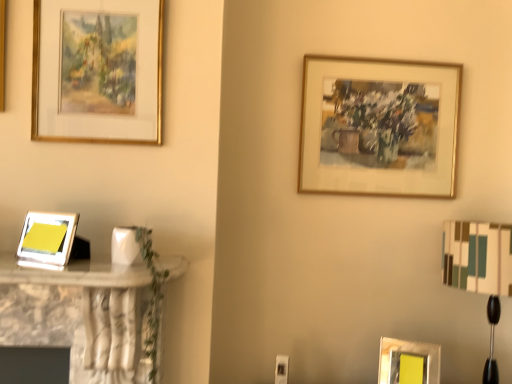
Question: From a real-world perspective, does matte silver picture frame at left, which appears as the fourth picture frame when viewed from the back, sit lower than gold-framed painting at upper left, the second picture frame viewed from the left?

Choices:
 (A) no
 (B) yes

Answer: (B)

Question: Can you confirm if matte silver picture frame at left, acting as the third picture frame starting from the top, is taller than gold-framed painting at upper left, the 1th picture frame from the top?

Choices:
 (A) yes
 (B) no

Answer: (B)

Question: Considering the relative positions of matte silver picture frame at left, acting as the third picture frame starting from the top, and gold-framed painting at upper left, the fourth picture frame in the bottom-to-top sequence, in the image provided, is matte silver picture frame at left, acting as the third picture frame starting from the top, behind gold-framed painting at upper left, the fourth picture frame in the bottom-to-top sequence,?

Choices:
 (A) yes
 (B) no

Answer: (B)

Question: From the image's perspective, is matte silver picture frame at left, which appears as the fourth picture frame when viewed from the back, below gold-framed painting at upper left, the 1th picture frame from the top?

Choices:
 (A) yes
 (B) no

Answer: (A)

Question: Can you confirm if matte silver picture frame at left, which appears as the fourth picture frame when viewed from the back, is wider than gold-framed painting at upper left, the 1th picture frame from the top?

Choices:
 (A) yes
 (B) no

Answer: (A)

Question: Is gold-framed painting at upper left, marked as the third picture frame in a back-to-front arrangement, at the back of matte silver picture frame at left, acting as the third picture frame starting from the top?

Choices:
 (A) yes
 (B) no

Answer: (B)

Question: Can you confirm if white fabric lampshade at right is smaller than gold-framed painting at upper left, the 1th picture frame from the top?

Choices:
 (A) no
 (B) yes

Answer: (A)

Question: From the image's perspective, is white fabric lampshade at right over gold-framed painting at upper left, the second picture frame viewed from the left?

Choices:
 (A) yes
 (B) no

Answer: (B)

Question: Does white fabric lampshade at right have a greater height compared to gold-framed painting at upper left, the fourth picture frame in the bottom-to-top sequence?

Choices:
 (A) yes
 (B) no

Answer: (A)

Question: Would you consider white fabric lampshade at right to be distant from gold-framed painting at upper left, marked as the third picture frame in a back-to-front arrangement?

Choices:
 (A) no
 (B) yes

Answer: (B)

Question: From a real-world perspective, is white fabric lampshade at right on gold-framed painting at upper left, the second picture frame viewed from the left?

Choices:
 (A) no
 (B) yes

Answer: (A)

Question: From the image's perspective, does white fabric lampshade at right appear lower than gold-framed painting at upper left, the fourth picture frame in the bottom-to-top sequence?

Choices:
 (A) no
 (B) yes

Answer: (B)

Question: From the image's perspective, is gold metallic picture frame at upper right, the third picture frame from the bottom, located beneath gold-framed painting at upper left, the second picture frame viewed from the left?

Choices:
 (A) yes
 (B) no

Answer: (A)